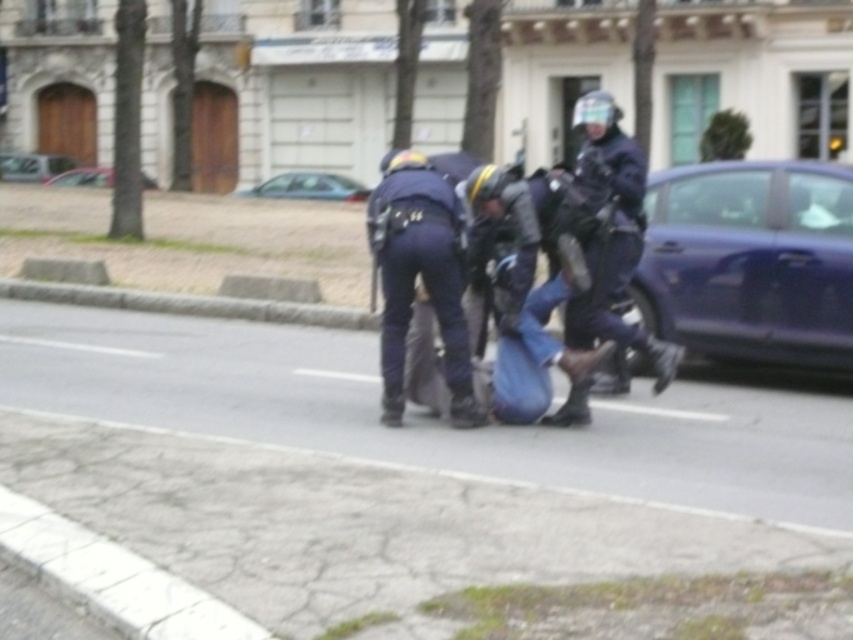
What do you see at coordinates (750, 260) in the screenshot?
I see `metallic blue sedan at right` at bounding box center [750, 260].

Who is positioned more to the right, metallic blue sedan at right or dark blue uniform at center?

Positioned to the right is metallic blue sedan at right.

In order to click on metallic blue sedan at right in this screenshot , I will do `click(750, 260)`.

Does metallic blue sedan at center have a larger size compared to metallic silver car at center?

Incorrect, metallic blue sedan at center is not larger than metallic silver car at center.

Between point (326, 173) and point (93, 176), which one is positioned in front?

Point (326, 173)

The image size is (853, 640). What are the coordinates of `metallic blue sedan at center` in the screenshot? It's located at (309, 186).

Based on the photo, can you confirm if metallic blue sedan at right is positioned to the right of silver metallic car at upper left?

Indeed, metallic blue sedan at right is positioned on the right side of silver metallic car at upper left.

Who is shorter, metallic blue sedan at right or silver metallic car at upper left?

silver metallic car at upper left is shorter.

Where is `metallic blue sedan at right`? The width and height of the screenshot is (853, 640). metallic blue sedan at right is located at coordinates (750, 260).